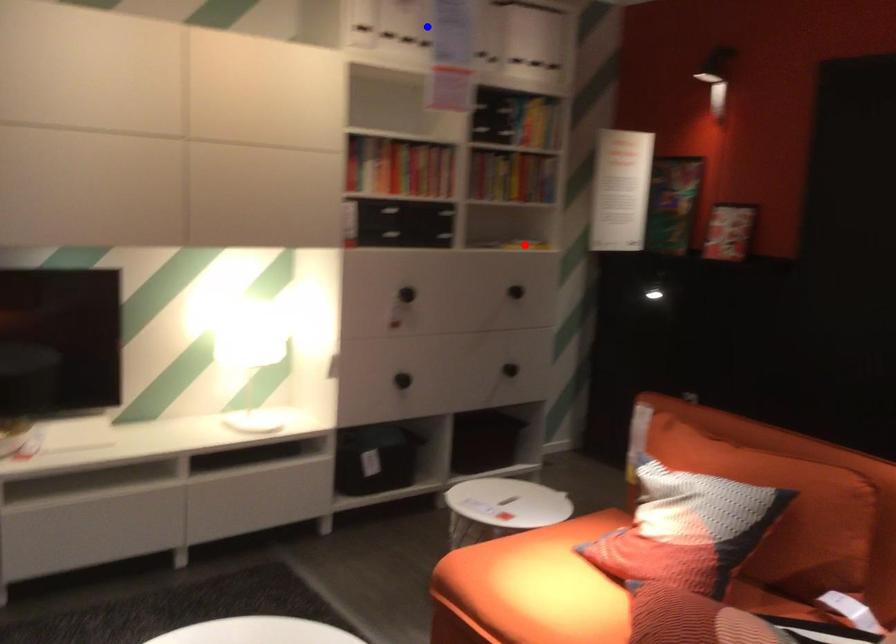
Question: Which of the two points in the image is closer to the camera?

Choices:
 (A) Blue point is closer.
 (B) Red point is closer.

Answer: (A)